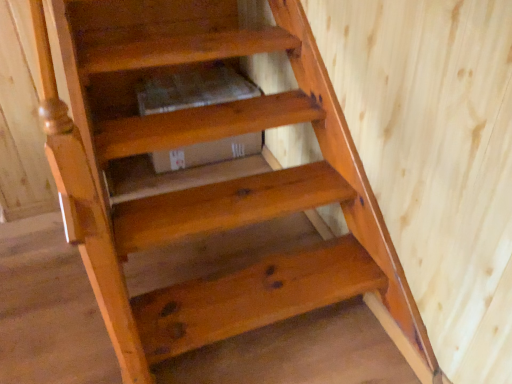
Question: Based on their sizes in the image, would you say natural wood stair at lower center, the first stairwell when ordered from bottom to top, is bigger or smaller than natural wood stair at center, the 1th stairwell when ordered from top to bottom?

Choices:
 (A) big
 (B) small

Answer: (A)

Question: Considering the positions of point (267, 304) and point (129, 241), is point (267, 304) closer or farther from the camera than point (129, 241)?

Choices:
 (A) closer
 (B) farther

Answer: (B)

Question: Do you think natural wood stair at lower center, which ranks as the 2th stairwell in top-to-bottom order, is within natural wood stair at center, the 1th stairwell when ordered from top to bottom, or outside of it?

Choices:
 (A) outside
 (B) inside

Answer: (A)

Question: Considering the positions of natural wood stair at center, the 1th stairwell when ordered from top to bottom, and natural wood stair at lower center, which ranks as the 2th stairwell in top-to-bottom order, in the image, is natural wood stair at center, the 1th stairwell when ordered from top to bottom, taller or shorter than natural wood stair at lower center, which ranks as the 2th stairwell in top-to-bottom order,?

Choices:
 (A) short
 (B) tall

Answer: (A)

Question: Is natural wood stair at center, the 1th stairwell when ordered from top to bottom, spatially inside natural wood stair at lower center, the first stairwell when ordered from bottom to top, or outside of it?

Choices:
 (A) outside
 (B) inside

Answer: (A)

Question: From the image's perspective, is natural wood stair at center, the 1th stairwell when ordered from top to bottom, positioned above or below natural wood stair at lower center, the first stairwell when ordered from bottom to top?

Choices:
 (A) above
 (B) below

Answer: (A)

Question: Based on their positions, is natural wood stair at center, the 1th stairwell when ordered from top to bottom, located to the left or right of natural wood stair at lower center, the first stairwell when ordered from bottom to top?

Choices:
 (A) right
 (B) left

Answer: (B)